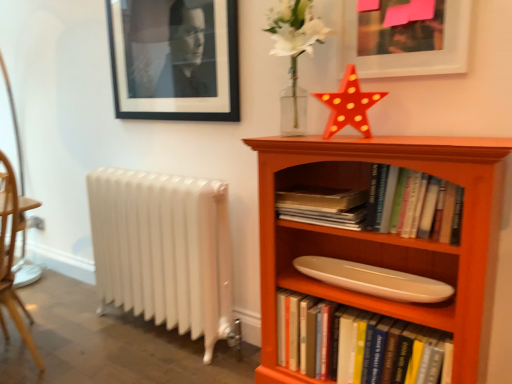
Question: Considering the relative sizes of shiny plastic star at upper center and black matte picture frame at upper left, which ranks as the 1th picture frame in back-to-front order, in the image provided, is shiny plastic star at upper center thinner than black matte picture frame at upper left, which ranks as the 1th picture frame in back-to-front order,?

Choices:
 (A) yes
 (B) no

Answer: (B)

Question: Is shiny plastic star at upper center not within black matte picture frame at upper left, which ranks as the 2th picture frame in right-to-left order?

Choices:
 (A) yes
 (B) no

Answer: (A)

Question: Does shiny plastic star at upper center have a greater height compared to black matte picture frame at upper left, the second picture frame positioned from the front?

Choices:
 (A) yes
 (B) no

Answer: (B)

Question: Is the depth of shiny plastic star at upper center greater than that of black matte picture frame at upper left, the second picture frame positioned from the front?

Choices:
 (A) yes
 (B) no

Answer: (B)

Question: From the image's perspective, is shiny plastic star at upper center under black matte picture frame at upper left, which ranks as the 2th picture frame in right-to-left order?

Choices:
 (A) no
 (B) yes

Answer: (B)

Question: Is point (118, 193) closer or farther from the camera than point (155, 16)?

Choices:
 (A) farther
 (B) closer

Answer: (A)

Question: From a real-world perspective, is white metallic radiator at lower left positioned above or below black matte picture frame at upper left, the second picture frame positioned from the front?

Choices:
 (A) below
 (B) above

Answer: (A)

Question: Based on their positions, is white metallic radiator at lower left located to the left or right of black matte picture frame at upper left, the second picture frame positioned from the front?

Choices:
 (A) right
 (B) left

Answer: (B)

Question: From the image's perspective, is white metallic radiator at lower left located above or below black matte picture frame at upper left, the second picture frame positioned from the front?

Choices:
 (A) below
 (B) above

Answer: (A)

Question: Is white glossy surfboard at center in front of or behind white glossy bookshelf at center, placed as the 1th book when sorted from bottom to top, in the image?

Choices:
 (A) front
 (B) behind

Answer: (B)

Question: Do you think white glossy surfboard at center is within white glossy bookshelf at center, placed as the 1th book when sorted from bottom to top, or outside of it?

Choices:
 (A) outside
 (B) inside

Answer: (A)

Question: From the image's perspective, is white glossy surfboard at center above or below white glossy bookshelf at center, placed as the 1th book when sorted from bottom to top?

Choices:
 (A) below
 (B) above

Answer: (B)

Question: From a real-world perspective, is white glossy surfboard at center physically located above or below white glossy bookshelf at center, the 2th book from the top?

Choices:
 (A) above
 (B) below

Answer: (A)

Question: Is orange wood bookcase at right wider or thinner than white glossy bookshelf at center, the 2th book from the top?

Choices:
 (A) wide
 (B) thin

Answer: (A)

Question: From a real-world perspective, relative to white glossy bookshelf at center, the 2th book from the top, is orange wood bookcase at right vertically above or below?

Choices:
 (A) above
 (B) below

Answer: (A)